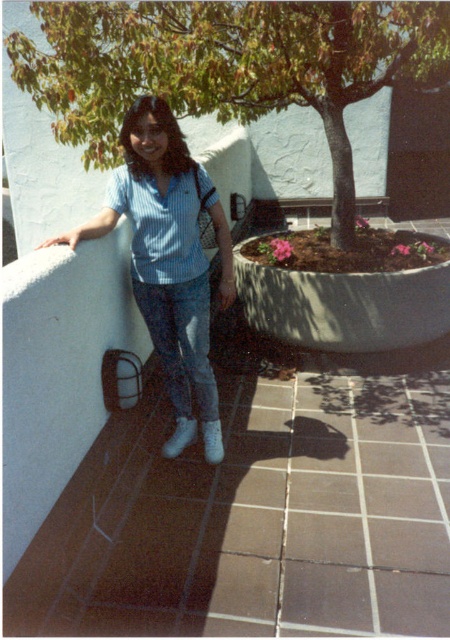
Question: Is blue striped shirt at upper left to the right of denim jeans at center from the viewer's perspective?

Choices:
 (A) no
 (B) yes

Answer: (A)

Question: Which of these objects is positioned farthest from the green leafy tree at center?

Choices:
 (A) blue striped shirt at upper left
 (B) denim jeans at center

Answer: (B)

Question: Is green leafy tree at center below blue striped shirt at upper left?

Choices:
 (A) no
 (B) yes

Answer: (A)

Question: Is green leafy tree at center to the left of blue striped shirt at upper left from the viewer's perspective?

Choices:
 (A) yes
 (B) no

Answer: (B)

Question: Which object appears farthest from the camera in this image?

Choices:
 (A) green leafy tree at center
 (B) denim jeans at center

Answer: (A)

Question: Which point is closer to the camera?

Choices:
 (A) blue striped shirt at upper left
 (B) green leafy tree at center

Answer: (A)